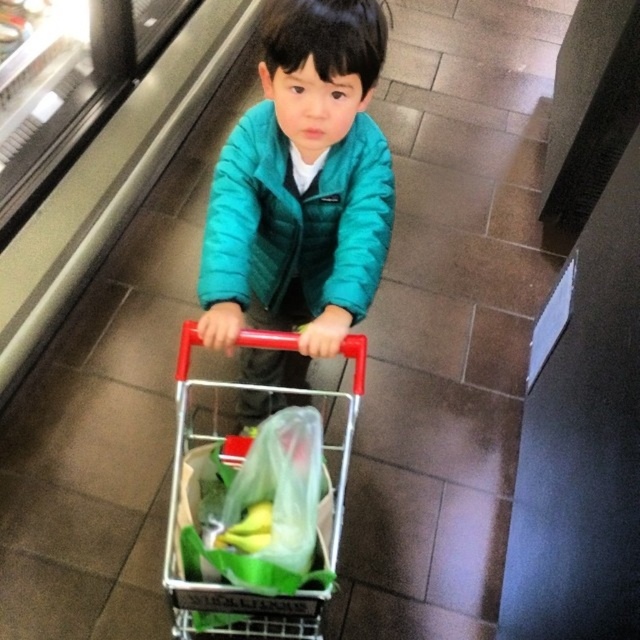
Which is above, metallic red trolley at center or translucent plastic bag at center?

Positioned higher is translucent plastic bag at center.

Can you confirm if metallic red trolley at center is shorter than translucent plastic bag at center?

Incorrect, metallic red trolley at center's height does not fall short of translucent plastic bag at center's.

Does point (237, 384) come behind point (195, 538)?

Yes, it is.

I want to click on metallic red trolley at center, so click(x=198, y=531).

Who is more forward, (346, 284) or (250, 605)?

Positioned in front is point (250, 605).

Which of these two, teal quilted jacket at center or metallic red trolley at center, stands shorter?

Standing shorter between the two is teal quilted jacket at center.

Between point (339, 298) and point (188, 381), which one is positioned behind?

The point (188, 381) is more distant.

Where is `teal quilted jacket at center`? The image size is (640, 640). teal quilted jacket at center is located at coordinates (296, 220).

How far apart are teal quilted jacket at center and translucent plastic bag at center?

teal quilted jacket at center is 13.06 inches from translucent plastic bag at center.

Who is lower down, teal quilted jacket at center or translucent plastic bag at center?

translucent plastic bag at center is below.

Between point (372, 132) and point (211, 538), which one is positioned behind?

Point (372, 132)

Locate an element on the screen. teal quilted jacket at center is located at coordinates (296, 220).